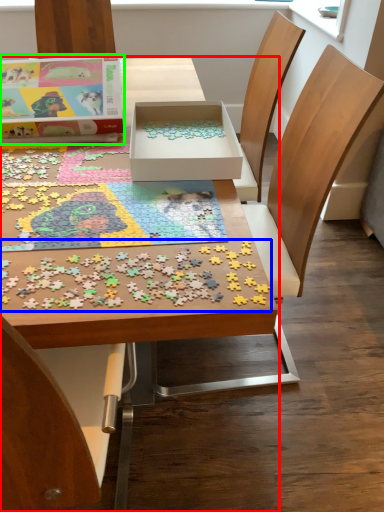
Question: Based on their relative distances, which object is farther from table (highlighted by a red box)? Choose from jigsaw puzzle (highlighted by a blue box) and box (highlighted by a green box).

Choices:
 (A) jigsaw puzzle
 (B) box

Answer: (B)